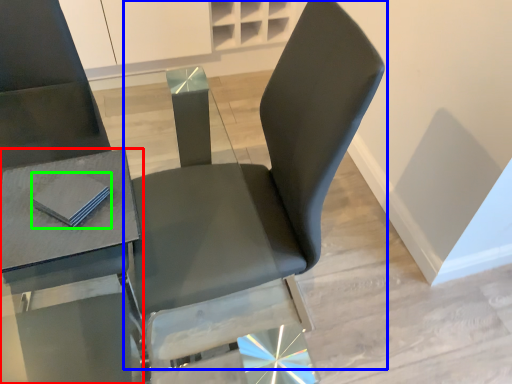
Question: Based on their relative distances, which object is nearer to table (highlighted by a red box)? Choose from chair (highlighted by a blue box) and pad (highlighted by a green box).

Choices:
 (A) chair
 (B) pad

Answer: (B)